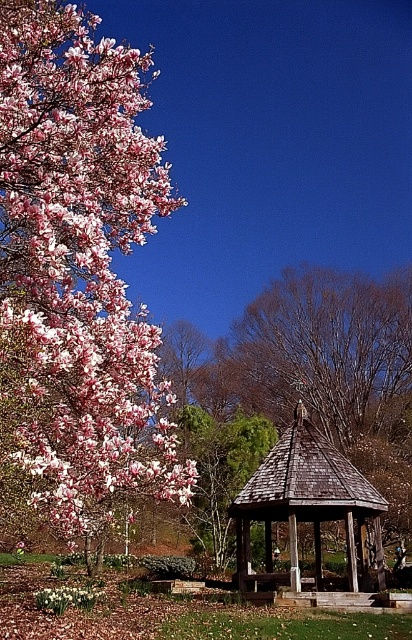
Who is higher up, pink matte flower at upper left or wooden gazebo at center?

pink matte flower at upper left is above.

Which is more to the right, pink matte flower at upper left or wooden gazebo at center?

wooden gazebo at center

This screenshot has width=412, height=640. Identify the location of pink matte flower at upper left. (x=77, y=266).